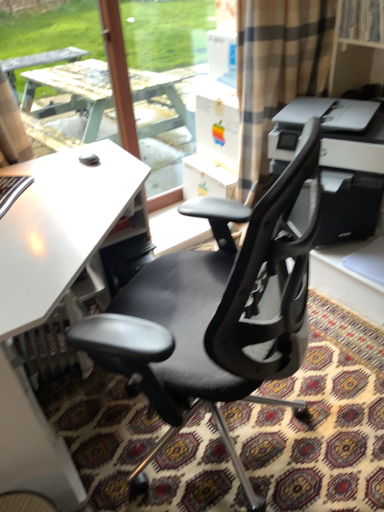
Question: From a real-world perspective, is white matte desk at center below black mesh office chair at center?

Choices:
 (A) yes
 (B) no

Answer: (A)

Question: Does white matte desk at center have a greater height compared to black mesh office chair at center?

Choices:
 (A) no
 (B) yes

Answer: (A)

Question: Could you tell me if white matte desk at center is facing black mesh office chair at center?

Choices:
 (A) yes
 (B) no

Answer: (A)

Question: From the image's perspective, would you say white matte desk at center is shown under black mesh office chair at center?

Choices:
 (A) yes
 (B) no

Answer: (B)

Question: Is white matte desk at center completely or partially outside of black mesh office chair at center?

Choices:
 (A) no
 (B) yes

Answer: (B)

Question: In terms of height, does white plastic printer at upper right look taller or shorter compared to black mesh office chair at center?

Choices:
 (A) short
 (B) tall

Answer: (A)

Question: Is white plastic printer at upper right inside or outside of black mesh office chair at center?

Choices:
 (A) outside
 (B) inside

Answer: (A)

Question: From a real-world perspective, is white plastic printer at upper right positioned above or below black mesh office chair at center?

Choices:
 (A) above
 (B) below

Answer: (A)

Question: Based on their sizes in the image, would you say white plastic printer at upper right is bigger or smaller than black mesh office chair at center?

Choices:
 (A) big
 (B) small

Answer: (B)

Question: Based on their positions, is white matte desk at center located to the left or right of white plastic printer at upper right?

Choices:
 (A) right
 (B) left

Answer: (B)

Question: Is white matte desk at center situated inside white plastic printer at upper right or outside?

Choices:
 (A) inside
 (B) outside

Answer: (B)

Question: Is point (72, 509) positioned closer to the camera than point (291, 155)?

Choices:
 (A) farther
 (B) closer

Answer: (B)

Question: From a real-world perspective, relative to white plastic printer at upper right, is white matte desk at center vertically above or below?

Choices:
 (A) above
 (B) below

Answer: (B)

Question: Looking at the image, does black mesh office chair at center seem bigger or smaller compared to white matte desk at center?

Choices:
 (A) small
 (B) big

Answer: (A)

Question: From the image's perspective, is black mesh office chair at center above or below white matte desk at center?

Choices:
 (A) below
 (B) above

Answer: (A)